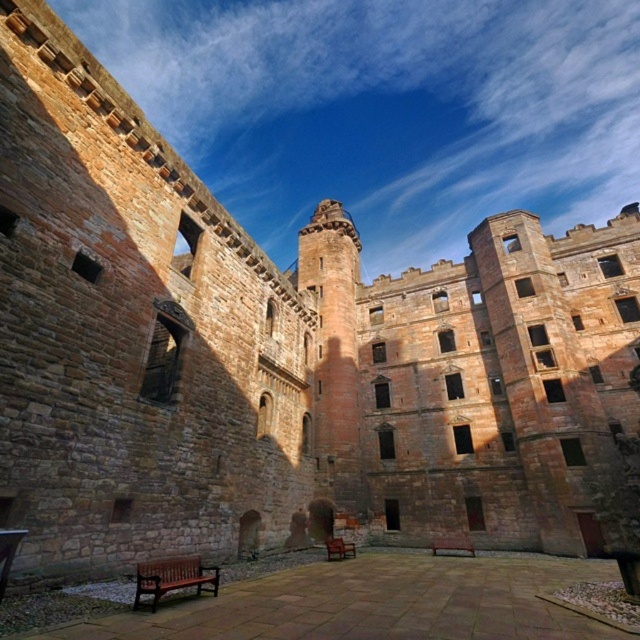
The width and height of the screenshot is (640, 640). Describe the element at coordinates (452, 547) in the screenshot. I see `brown wooden bench at center` at that location.

Based on the photo, is brown wooden bench at center wider than wooden bench at center?

Indeed, brown wooden bench at center has a greater width compared to wooden bench at center.

The image size is (640, 640). In order to click on brown wooden bench at center in this screenshot , I will do `click(452, 547)`.

Does brown wooden bench at lower center appear under brown wooden bench at lower left?

Yes, brown wooden bench at lower center is below brown wooden bench at lower left.

In the scene shown: Is brown wooden bench at lower center positioned before brown wooden bench at lower left?

Yes, it is.

At what (x,y) coordinates should I click in order to perform the action: click on brown wooden bench at lower center. Please return your answer as a coordinate pair (x, y). This screenshot has width=640, height=640. Looking at the image, I should click on (372, 604).

Find the location of a particular element. brown wooden bench at lower center is located at coordinates (372, 604).

Is brown wooden bench at lower center above brown wooden bench at center?

Yes, brown wooden bench at lower center is above brown wooden bench at center.

This screenshot has height=640, width=640. I want to click on brown wooden bench at lower center, so click(x=372, y=604).

This screenshot has width=640, height=640. What do you see at coordinates (372, 604) in the screenshot? I see `brown wooden bench at lower center` at bounding box center [372, 604].

In order to click on brown wooden bench at lower center in this screenshot , I will do `click(372, 604)`.